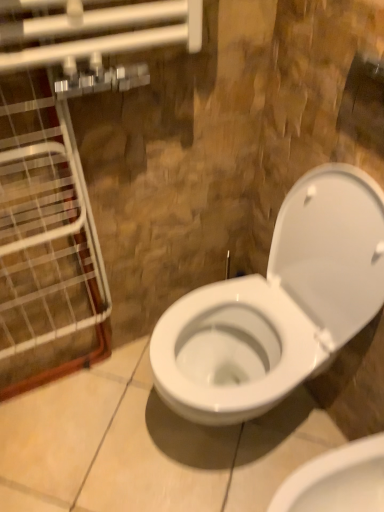
The image size is (384, 512). I want to click on free location in front of clear glass door at left, so click(64, 448).